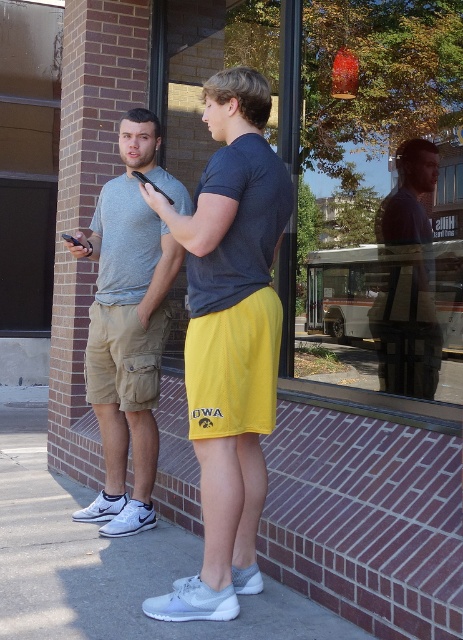
Question: Does white rubber shoe at lower center have a smaller size compared to matte gray shirt at center?

Choices:
 (A) yes
 (B) no

Answer: (B)

Question: Among these objects, which one is nearest to the camera?

Choices:
 (A) matte khaki shorts at left
 (B) matte gray shirt at center

Answer: (B)

Question: Does yellow athletic shorts at center have a smaller size compared to white rubber shoe at lower center?

Choices:
 (A) no
 (B) yes

Answer: (A)

Question: Is matte khaki shorts at left above matte gray shirt at center?

Choices:
 (A) no
 (B) yes

Answer: (A)

Question: Estimate the real-world distances between objects in this image. Which object is farther from the matte khaki shorts at left?

Choices:
 (A) matte gray shirt at center
 (B) yellow athletic shorts at center

Answer: (A)

Question: Which object appears farthest from the camera in this image?

Choices:
 (A) yellow athletic shorts at center
 (B) matte gray shirt at center

Answer: (B)